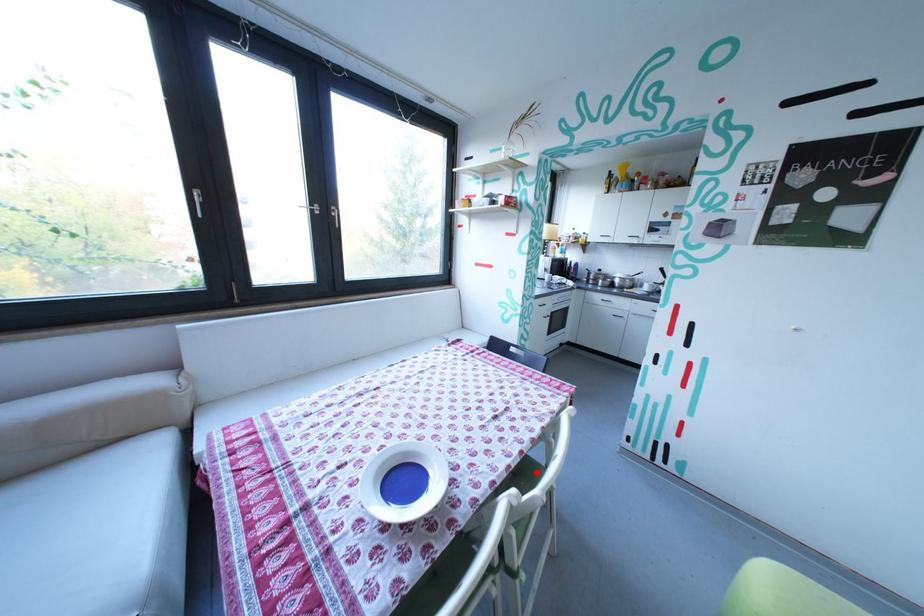
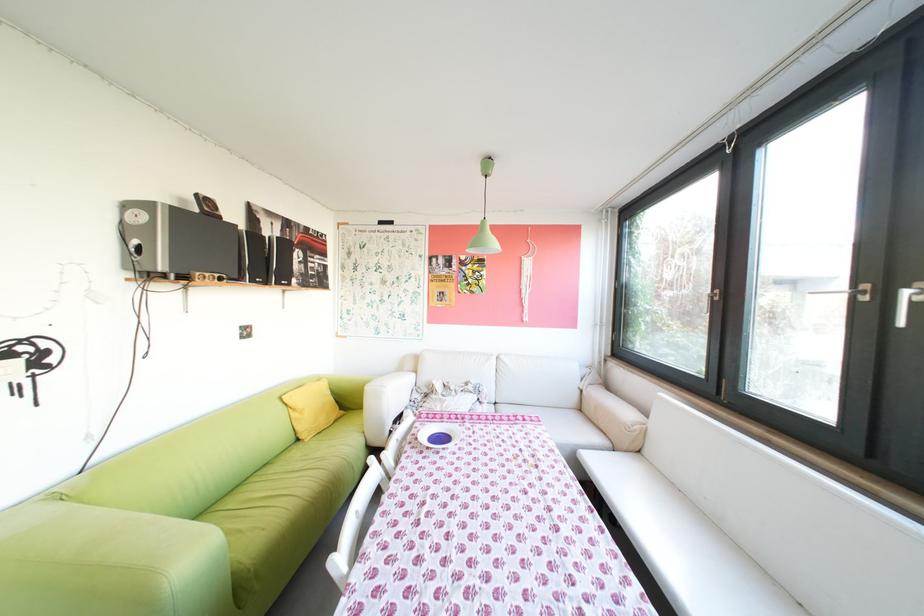
Question: I am providing you with two images of the same scene from different viewpoints. A red point is marked on the first image. Can you still see the location of the red point in image 2?

Choices:
 (A) Yes
 (B) No

Answer: (B)